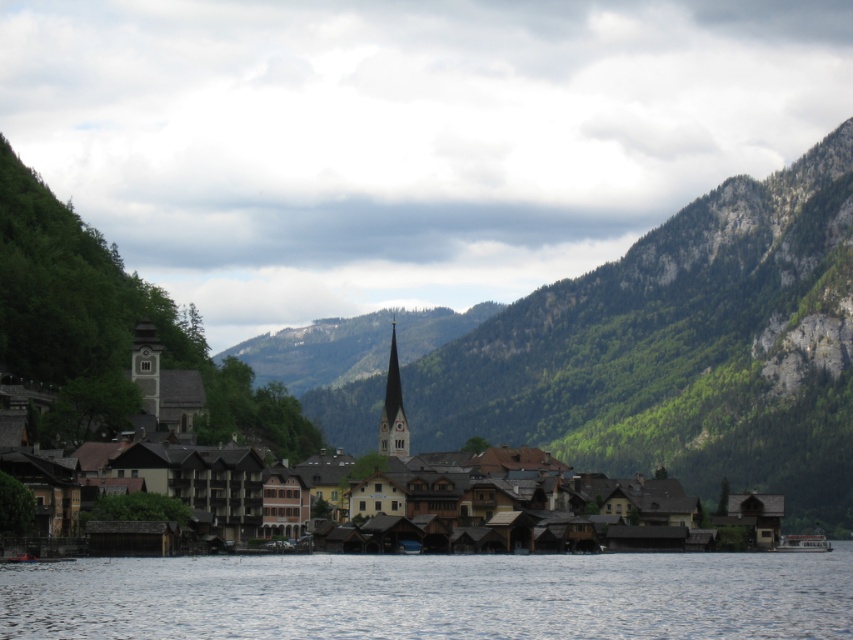
Measure the distance between point (250, 620) and camera.

Point (250, 620) is 65.32 meters from camera.

Between transparent water at lower center and brown wooden houses at center, which one has more height?

brown wooden houses at center is taller.

Is point (676, 602) closer to viewer compared to point (160, 410)?

Yes, point (676, 602) is closer to viewer.

The width and height of the screenshot is (853, 640). Find the location of `transparent water at lower center`. transparent water at lower center is located at coordinates (433, 595).

Between point (132, 488) and point (399, 410), which one is positioned in front?

Positioned in front is point (132, 488).

Does brown wooden houses at center appear over smooth light brown spire at center?

No, brown wooden houses at center is not above smooth light brown spire at center.

From the picture: Who is more forward, [349,458] or [393,352]?

Point [349,458] is in front.

Locate an element on the screen. This screenshot has width=853, height=640. brown wooden houses at center is located at coordinates (154, 424).

Which is behind, point (142, 337) or point (808, 540)?

The point (808, 540) is more distant.

The width and height of the screenshot is (853, 640). What do you see at coordinates (154, 424) in the screenshot?
I see `brown wooden houses at center` at bounding box center [154, 424].

What do you see at coordinates (154, 424) in the screenshot? The width and height of the screenshot is (853, 640). I see `brown wooden houses at center` at bounding box center [154, 424].

Find the location of `brown wooden houses at center`. brown wooden houses at center is located at coordinates (154, 424).